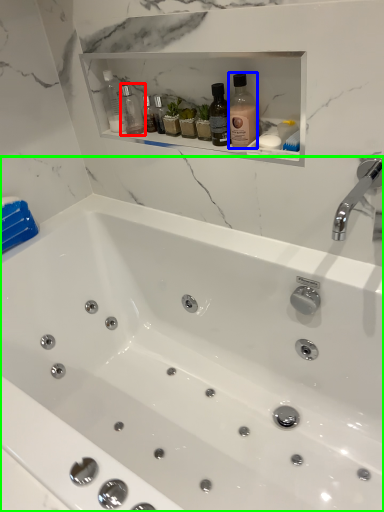
Question: Which is nearer to the bottle (highlighted by a red box)? bottle (highlighted by a blue box) or bathtub (highlighted by a green box).

Choices:
 (A) bottle
 (B) bathtub

Answer: (A)